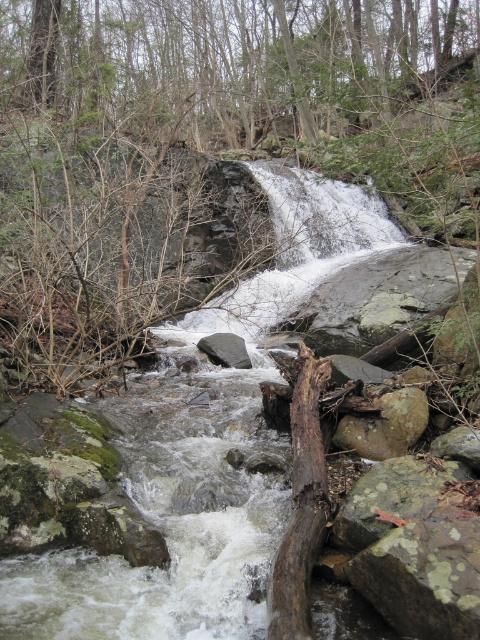
Question: Where is green leafy tree at upper center located in relation to gray rock at center in the image?

Choices:
 (A) above
 (B) below

Answer: (A)

Question: Which object appears farthest from the camera in this image?

Choices:
 (A) gray rock at center
 (B) brown rough rock at center
 (C) green leafy tree at upper center
 (D) white rocky stream at center

Answer: (C)

Question: Can you confirm if white rocky stream at center is thinner than gray rock at center?

Choices:
 (A) yes
 (B) no

Answer: (B)

Question: Does green leafy tree at upper center lie behind brown rough rock at center?

Choices:
 (A) yes
 (B) no

Answer: (A)

Question: Which is nearer to the green leafy tree at upper center?

Choices:
 (A) white rocky stream at center
 (B) brown rough rock at center
 (C) gray rock at center
 (D) brown rough log at center

Answer: (A)

Question: Estimate the real-world distances between objects in this image. Which object is closer to the gray rock at center?

Choices:
 (A) white rocky stream at center
 (B) brown rough log at center
 (C) green leafy tree at upper center

Answer: (A)